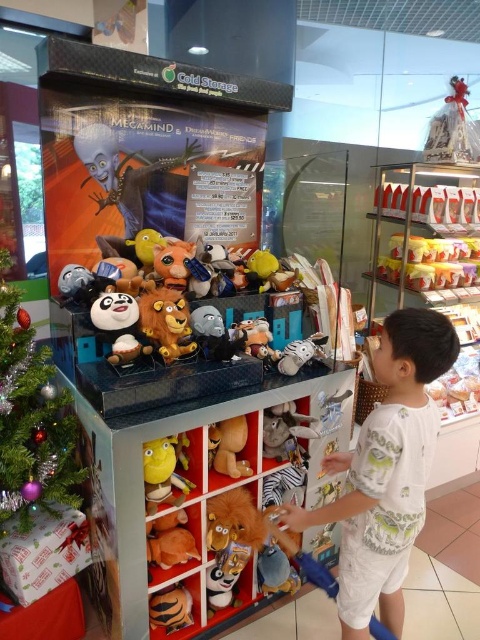
Question: Which object is the farthest from the brown plush toy at center?

Choices:
 (A) yellow plush toy at upper right
 (B) brown plush tiger at lower left

Answer: (A)

Question: Does fluffy orange plush lion at lower center have a lesser width compared to brown plush toy at center?

Choices:
 (A) yes
 (B) no

Answer: (B)

Question: Which of the following is the closest to the observer?

Choices:
 (A) yellow plush toy at upper right
 (B) green shiny christmas tree at lower left
 (C) fluffy orange plush lion at lower center

Answer: (B)

Question: Is brown plush toy at center in front of brown plush tiger at lower left?

Choices:
 (A) no
 (B) yes

Answer: (A)

Question: Which of these objects is positioned farthest from the green shiny christmas tree at lower left?

Choices:
 (A) fluffy orange plush lion at lower center
 (B) white cotton shirt at center

Answer: (B)

Question: Where is brown plush toy at center located in relation to brown plush tiger at lower left in the image?

Choices:
 (A) above
 (B) below

Answer: (A)